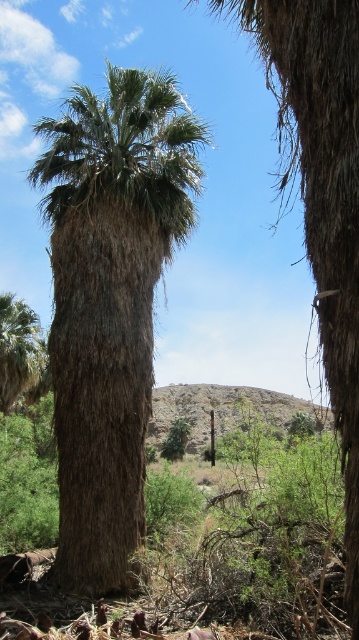
You are planning to plant a new palm tree in your backyard. You have two options based on the image you see. The brown textured palm tree at center and the green leafy palm tree at lower left. Which one has a wider trunk?

The brown textured palm tree at center might be wider than green leafy palm tree at lower left.

You are standing in front of the brown textured palm tree at center and want to take a photo of it with your camera. The camera requires a minimum distance of 10 meters to focus properly. Based on the scene, will the camera be able to focus on the palm tree?

The distance between the brown textured palm tree at center and the camera is 9.81 meters, which is less than the required 10 meters. Therefore, the camera will not be able to focus properly on the palm tree.